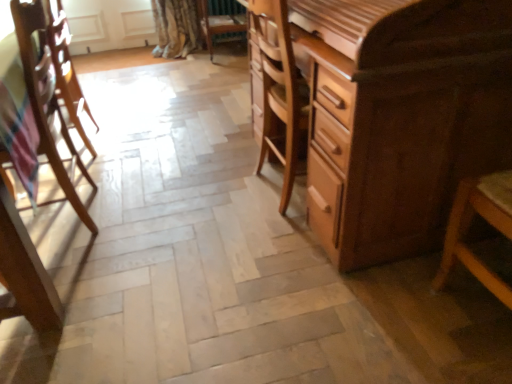
Question: Is wooden chair at left, the first chair in the left-to-right sequence, closer to the viewer compared to wooden chair at center, the 2th chair when ordered from bottom to top?

Choices:
 (A) no
 (B) yes

Answer: (B)

Question: Is wooden chair at left, which is the 1th chair in bottom-to-top order, positioned with its back to wooden chair at center, the 2th chair positioned from the front?

Choices:
 (A) yes
 (B) no

Answer: (A)

Question: Is wooden chair at left, the 2th chair viewed from the top, bigger than wooden chair at center, which appears as the second chair when viewed from the left?

Choices:
 (A) yes
 (B) no

Answer: (A)

Question: Does wooden chair at left, which is the 1th chair in bottom-to-top order, have a greater height compared to wooden chair at center, which appears as the second chair when viewed from the left?

Choices:
 (A) yes
 (B) no

Answer: (A)

Question: Is wooden chair at left, which is the 1th chair in bottom-to-top order, to the right of wooden chair at center, the 2th chair when ordered from bottom to top, from the viewer's perspective?

Choices:
 (A) no
 (B) yes

Answer: (A)

Question: From a real-world perspective, is wooden chair at center, placed as the 1th chair when sorted from right to left, above or below wooden chair at left, the first chair in the left-to-right sequence?

Choices:
 (A) below
 (B) above

Answer: (A)

Question: Is wooden chair at center, placed as the 1th chair when sorted from right to left, to the left or to the right of wooden chair at left, placed as the second chair when sorted from right to left, in the image?

Choices:
 (A) right
 (B) left

Answer: (A)

Question: Relative to wooden chair at left, which is the second chair in back-to-front order, is wooden chair at center, the 2th chair when ordered from bottom to top, in front or behind?

Choices:
 (A) front
 (B) behind

Answer: (B)

Question: Considering the positions of wooden chair at center, the first chair when ordered from top to bottom, and wooden chair at left, which is the second chair in back-to-front order, in the image, is wooden chair at center, the first chair when ordered from top to bottom, bigger or smaller than wooden chair at left, which is the second chair in back-to-front order,?

Choices:
 (A) small
 (B) big

Answer: (A)

Question: Considering the positions of wooden chair at left, placed as the second chair when sorted from right to left, and wooden armchair at left in the image, is wooden chair at left, placed as the second chair when sorted from right to left, bigger or smaller than wooden armchair at left?

Choices:
 (A) small
 (B) big

Answer: (B)

Question: From the image's perspective, is wooden chair at left, which is the 1th chair in bottom-to-top order, positioned above or below wooden armchair at left?

Choices:
 (A) below
 (B) above

Answer: (A)

Question: Relative to wooden armchair at left, is wooden chair at left, which appears as the 1th chair when viewed from the front, in front or behind?

Choices:
 (A) front
 (B) behind

Answer: (A)

Question: Considering the positions of wooden chair at left, which appears as the 1th chair when viewed from the front, and wooden armchair at left in the image, is wooden chair at left, which appears as the 1th chair when viewed from the front, taller or shorter than wooden armchair at left?

Choices:
 (A) tall
 (B) short

Answer: (B)

Question: From a real-world perspective, is wooden armchair at left positioned above or below wooden chair at center, the first chair when ordered from top to bottom?

Choices:
 (A) above
 (B) below

Answer: (A)

Question: Is wooden armchair at left to the left or to the right of wooden chair at center, the 2th chair when ordered from bottom to top, in the image?

Choices:
 (A) right
 (B) left

Answer: (B)